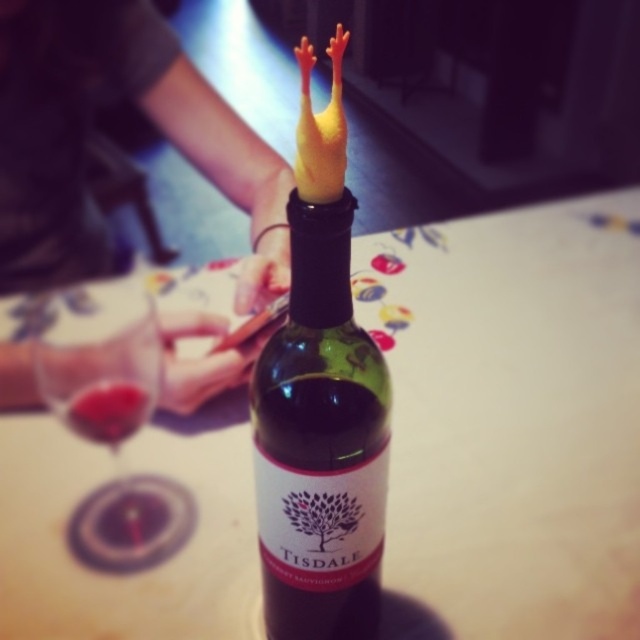
Question: Which object is the closest to the translucent glass wine at lower left?

Choices:
 (A) green matte wine bottle at center
 (B) white glossy table at center
 (C) transparent glass at lower left

Answer: (C)

Question: Is green matte wine bottle at center further to the viewer compared to translucent glass wine at lower left?

Choices:
 (A) yes
 (B) no

Answer: (B)

Question: Is green matte wine bottle at center below translucent glass wine at lower left?

Choices:
 (A) no
 (B) yes

Answer: (B)

Question: Among these points, which one is nearest to the camera?

Choices:
 (A) (92, 328)
 (B) (365, 449)
 (C) (202, 614)

Answer: (B)

Question: Can you confirm if green matte wine bottle at center is smaller than translucent glass wine at lower left?

Choices:
 (A) no
 (B) yes

Answer: (A)

Question: Which object is farther from the camera taking this photo?

Choices:
 (A) green matte wine bottle at center
 (B) transparent glass at lower left
 (C) translucent glass wine at lower left

Answer: (C)